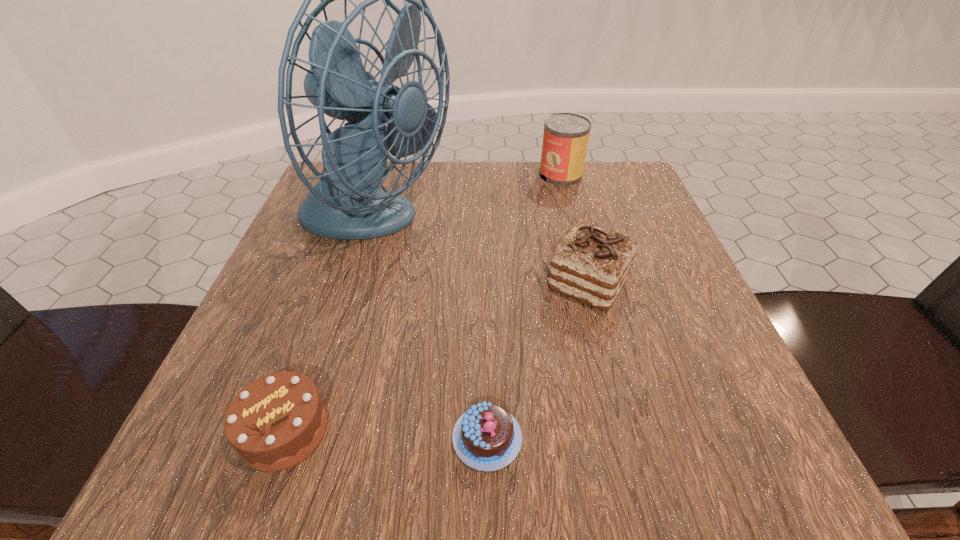
Find the location of a particular element. This screenshot has height=540, width=960. the tallest object is located at coordinates (345, 204).

At what (x,y) coordinates should I click in order to perform the action: click on can. Please return your answer as a coordinate pair (x, y). Looking at the image, I should click on (565, 139).

Where is `the farthest chocolate cake`? The image size is (960, 540). the farthest chocolate cake is located at coordinates (591, 264).

The image size is (960, 540). What are the coordinates of `the tallest chocolate cake` in the screenshot? It's located at (591, 264).

Where is `the fourth tallest object`? the fourth tallest object is located at coordinates (275, 422).

This screenshot has width=960, height=540. I want to click on the second tallest chocolate cake, so click(x=275, y=422).

Locate an element on the screen. The height and width of the screenshot is (540, 960). the shortest object is located at coordinates (486, 437).

You are a GUI agent. You are given a task and a screenshot of the screen. Output one action in this format:
    pyautogui.click(x=<x>, y=<y>)
    Task: Click on the third object from left to right
    
    Given the screenshot: What is the action you would take?
    pyautogui.click(x=486, y=437)

This screenshot has height=540, width=960. Identify the location of vacant space situated 0.090m in front of the tallest object to blow air. (497, 225).

In order to click on free space located 0.180m on the front of the second tallest object in this screenshot , I will do `click(576, 233)`.